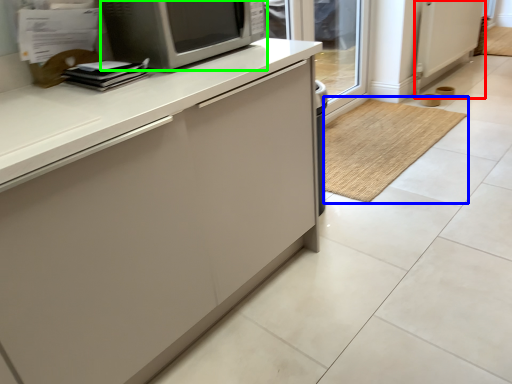
Question: Based on their relative distances, which object is nearer to screen door (highlighted by a red box)? Choose from doormat (highlighted by a blue box) and microwave oven (highlighted by a green box).

Choices:
 (A) doormat
 (B) microwave oven

Answer: (A)